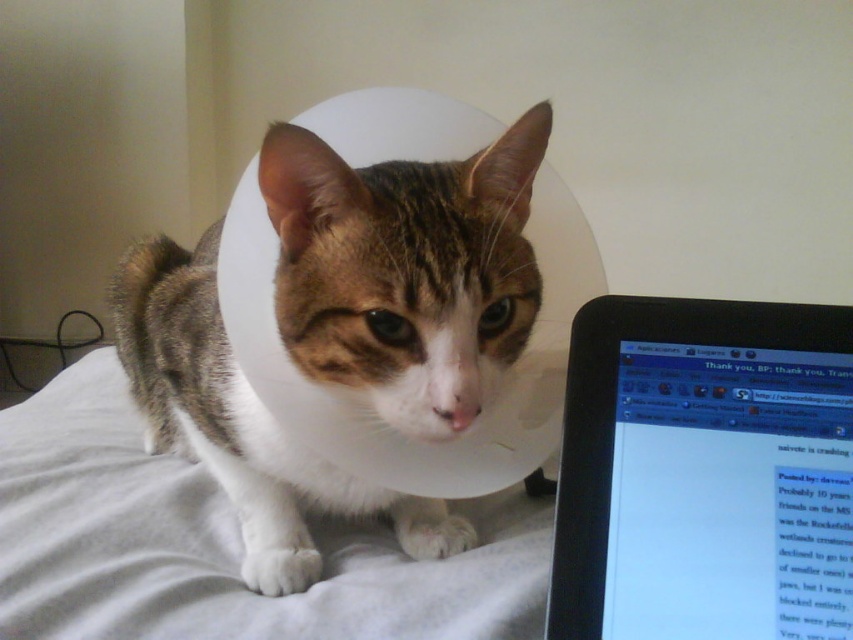
Can you confirm if tabby fur cat at center is smaller than black glossy laptop at right?

No, tabby fur cat at center is not smaller than black glossy laptop at right.

Measure the distance between tabby fur cat at center and black glossy laptop at right.

They are 8.23 inches apart.

In order to click on tabby fur cat at center in this screenshot , I will do `click(405, 269)`.